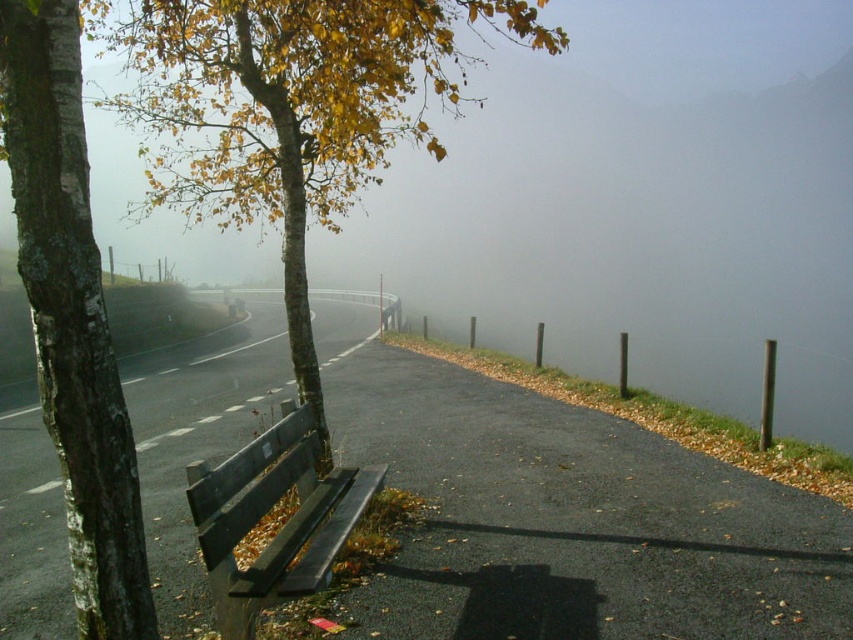
Measure the distance between point (587, 432) and camera.

They are 9.85 meters apart.

Is point (379, 417) positioned in front of point (370, 470)?

No, (379, 417) is further to viewer.

Is point (39, 499) more distant than point (224, 589)?

Yes.

Identify the location of dark gray asphalt road at center. The image size is (853, 640). (567, 515).

Who is positioned more to the left, dark gray asphalt road at center or smooth bark tree at left?

dark gray asphalt road at center is more to the left.

Which is behind, point (541, 534) or point (128, 524)?

Point (541, 534)

Between point (451, 408) and point (78, 289), which one is positioned in front?

Point (78, 289) is more forward.

The image size is (853, 640). What are the coordinates of `dark gray asphalt road at center` in the screenshot? It's located at (567, 515).

Is yellow-green leafy tree at left shorter than wooden bench at lower left?

No.

Between point (228, 104) and point (294, 534), which one is positioned in front?

Positioned in front is point (294, 534).

Where is `yellow-green leafy tree at left`? The width and height of the screenshot is (853, 640). yellow-green leafy tree at left is located at coordinates (291, 109).